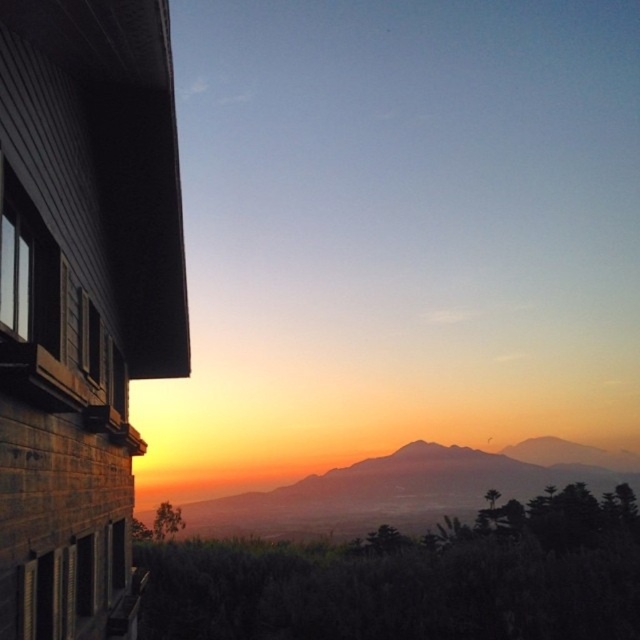
Does point (515, 465) lie in front of point (124, 401)?

No.

The width and height of the screenshot is (640, 640). What are the coordinates of `orange-hued mountain range at center` in the screenshot? It's located at (410, 488).

Find the location of a particular element. orange-hued mountain range at center is located at coordinates (410, 488).